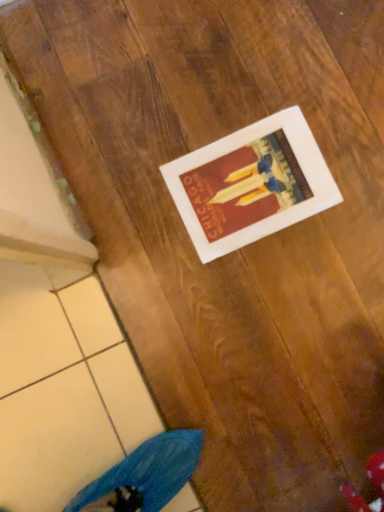
The width and height of the screenshot is (384, 512). What are the coordinates of `vacant space situated above white matte picture frame at center (from a real-world perspective)` in the screenshot? It's located at (250, 183).